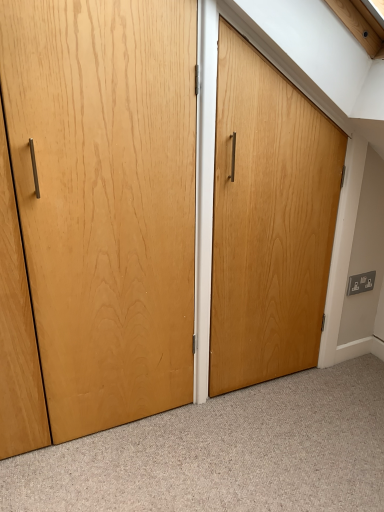
Question: From a real-world perspective, is satin silver outlet at right over natural wood door at center?

Choices:
 (A) no
 (B) yes

Answer: (A)

Question: From the image's perspective, is satin silver outlet at right on natural wood door at center?

Choices:
 (A) no
 (B) yes

Answer: (A)

Question: Is satin silver outlet at right aimed at natural wood door at center?

Choices:
 (A) no
 (B) yes

Answer: (A)

Question: Is satin silver outlet at right positioned in front of natural wood door at center?

Choices:
 (A) no
 (B) yes

Answer: (A)

Question: Is satin silver outlet at right bigger than natural wood door at center?

Choices:
 (A) no
 (B) yes

Answer: (A)

Question: From a real-world perspective, is satin silver outlet at right physically below natural wood door at center?

Choices:
 (A) yes
 (B) no

Answer: (A)

Question: From the image's perspective, is natural wood door at center on satin silver outlet at right?

Choices:
 (A) no
 (B) yes

Answer: (B)

Question: Can you confirm if natural wood door at center is taller than satin silver outlet at right?

Choices:
 (A) yes
 (B) no

Answer: (A)

Question: Is satin silver outlet at right at the back of natural wood door at center?

Choices:
 (A) yes
 (B) no

Answer: (B)

Question: Can you confirm if natural wood door at center is bigger than satin silver outlet at right?

Choices:
 (A) yes
 (B) no

Answer: (A)

Question: Is natural wood door at center not within satin silver outlet at right?

Choices:
 (A) no
 (B) yes

Answer: (B)

Question: Considering the relative sizes of natural wood door at center and satin silver outlet at right in the image provided, is natural wood door at center smaller than satin silver outlet at right?

Choices:
 (A) no
 (B) yes

Answer: (A)

Question: Would you say natural wood door at center is to the left or to the right of satin silver outlet at right in the picture?

Choices:
 (A) right
 (B) left

Answer: (B)